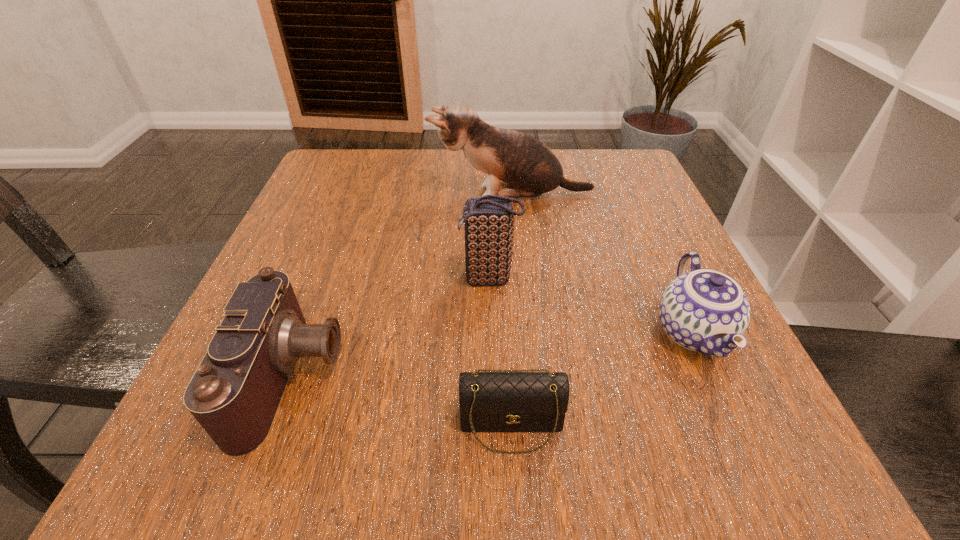
This screenshot has width=960, height=540. Find the location of `vacant space located with the zip open on the second tallest object`. vacant space located with the zip open on the second tallest object is located at coordinates (285, 279).

I want to click on vacant area situated 0.100m with the zip open on the second tallest object, so (402, 279).

Locate an element on the screen. free space located with the zip open on the second tallest object is located at coordinates (361, 279).

Find the location of a particular element. This screenshot has width=960, height=540. vacant space located on the front-facing side of the leftmost object is located at coordinates 447,377.

I want to click on vacant space located at the spout of the rightmost object, so click(758, 478).

The width and height of the screenshot is (960, 540). I want to click on object that is at the far edge, so click(x=528, y=168).

Locate an element on the screen. This screenshot has width=960, height=540. camera located in the near edge section of the desktop is located at coordinates (236, 390).

Image resolution: width=960 pixels, height=540 pixels. In order to click on clutch bag present at the near edge in this screenshot , I will do pyautogui.click(x=497, y=400).

Image resolution: width=960 pixels, height=540 pixels. In order to click on object located at the left edge in this screenshot , I will do `click(236, 390)`.

Where is `cat present at the right edge`? This screenshot has width=960, height=540. cat present at the right edge is located at coordinates (528, 168).